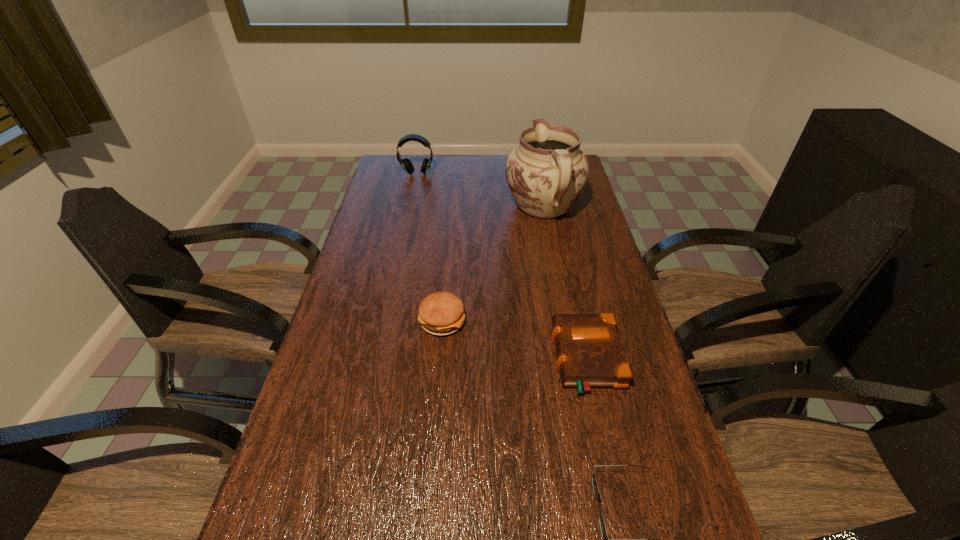
Where is `object that is at the far left corner`? object that is at the far left corner is located at coordinates (407, 165).

Locate an element on the screen. The width and height of the screenshot is (960, 540). object situated at the far right corner is located at coordinates (546, 173).

Locate an element on the screen. This screenshot has width=960, height=540. free space at the far edge is located at coordinates (499, 172).

What are the coordinates of `vacant space at the left edge of the desktop` in the screenshot? It's located at (393, 240).

The image size is (960, 540). I want to click on vacant space at the right edge of the desktop, so click(x=573, y=303).

Locate an element on the screen. The width and height of the screenshot is (960, 540). vacant region at the far left corner of the desktop is located at coordinates (391, 157).

Locate an element on the screen. This screenshot has height=540, width=960. unoccupied area between the Bible and the second farthest object is located at coordinates (565, 284).

Find the location of a particular element. vacant space that's between the hamburger and the pitcher is located at coordinates (492, 265).

Locate an element on the screen. This screenshot has height=540, width=960. vacant area that lies between the tallest object and the leftmost object is located at coordinates (480, 191).

Locate an element on the screen. The height and width of the screenshot is (540, 960). free space between the second shortest object and the hamburger is located at coordinates (515, 340).